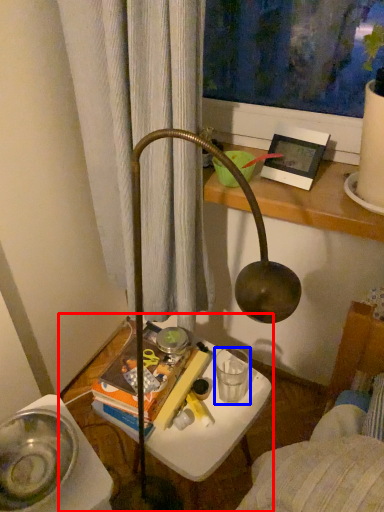
Question: Which point is further to the camera, table (highlighted by a red box) or beverage (highlighted by a blue box)?

Choices:
 (A) table
 (B) beverage

Answer: (B)